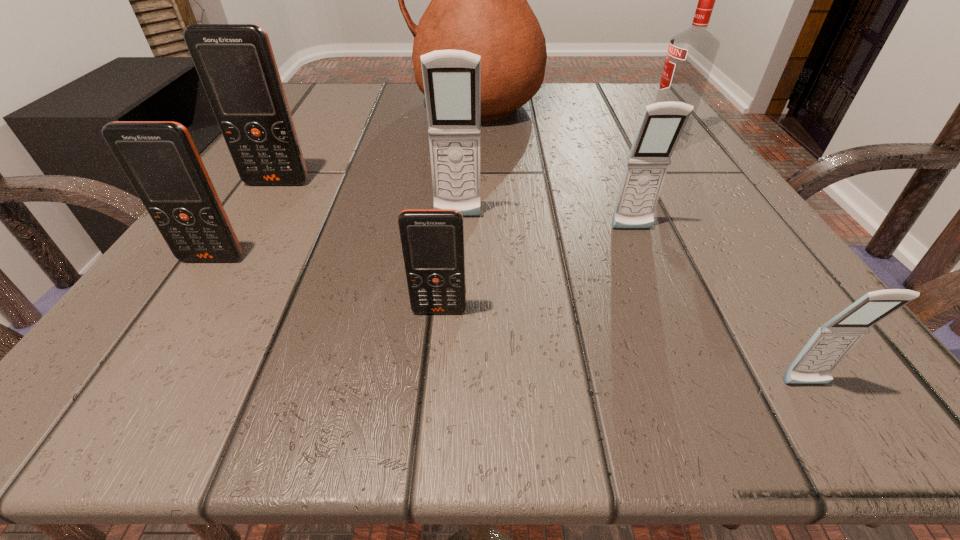
Identify the location of vacant space located 0.240m on the front-facing side of the fourth farthest object. The width and height of the screenshot is (960, 540). (448, 366).

Where is `free location located on the screen of the farthest orange cellular telephone`? The image size is (960, 540). free location located on the screen of the farthest orange cellular telephone is located at coordinates (204, 298).

Locate an element on the screen. free location located 0.180m on the front-facing side of the second gray cellular telephone from right to left is located at coordinates (678, 339).

The image size is (960, 540). I want to click on free space located 0.190m on the screen of the second smallest orange cellular telephone, so click(118, 398).

You are a GUI agent. You are given a task and a screenshot of the screen. Output one action in this format:
    pyautogui.click(x=<x>, y=<y>)
    Task: Click on the free region located on the screen of the nearest orange cellular telephone
    The height and width of the screenshot is (540, 960).
    Given the screenshot: What is the action you would take?
    pyautogui.click(x=432, y=395)

Where is `object present at the far edge`? This screenshot has width=960, height=540. object present at the far edge is located at coordinates (478, 4).

The image size is (960, 540). Find the location of `object at the near edge`. object at the near edge is located at coordinates (830, 344).

Where is `vodka located at the right edge`? This screenshot has width=960, height=540. vodka located at the right edge is located at coordinates (691, 54).

Find the location of a particular element. This screenshot has height=540, width=960. object that is at the near right corner is located at coordinates (830, 344).

The image size is (960, 540). In order to click on vacant region at the far edge of the desktop in this screenshot , I will do `click(562, 82)`.